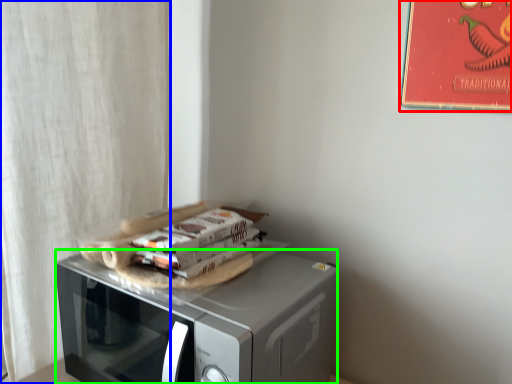
Question: Considering the real-world distances, which object is farthest from bulletin board (highlighted by a red box)? curtain (highlighted by a blue box) or microwave oven (highlighted by a green box)?

Choices:
 (A) curtain
 (B) microwave oven

Answer: (A)